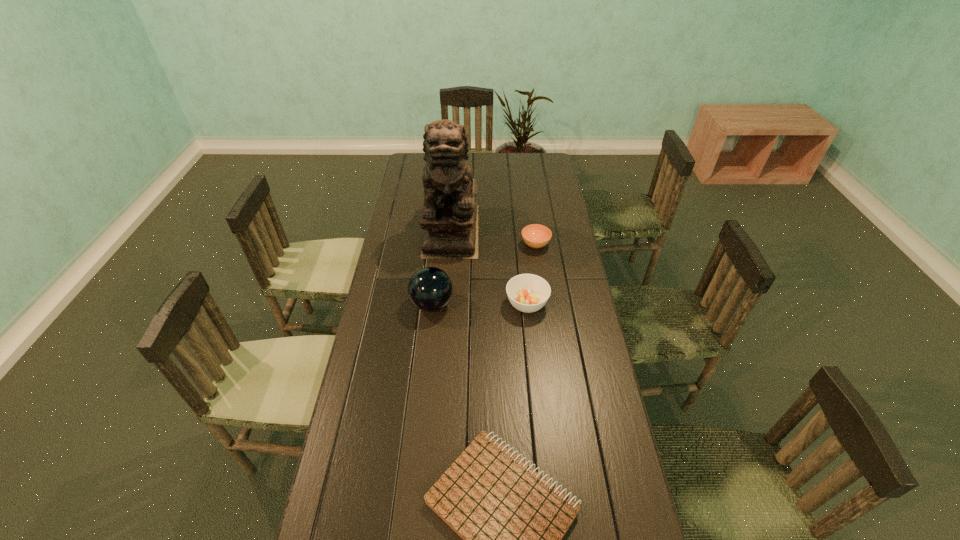
Image resolution: width=960 pixels, height=540 pixels. In order to click on sculpture in this screenshot , I will do pos(449,218).

What are the coordinates of `the fourth shortest object` in the screenshot? It's located at (430, 289).

Locate an element on the screen. This screenshot has width=960, height=540. the third tallest object is located at coordinates (528, 293).

This screenshot has height=540, width=960. Find the location of `the nearer soup bowl`. the nearer soup bowl is located at coordinates (528, 293).

Identify the location of the farther soup bowl. This screenshot has height=540, width=960. (535, 235).

Locate an element on the screen. the second shortest object is located at coordinates (535, 235).

Locate an element on the screen. free space located 0.060m on the front-facing side of the tallest object is located at coordinates [x=448, y=269].

This screenshot has height=540, width=960. Find the location of `vacant region located 0.190m on the side of the bowling ball with the finger holes`. vacant region located 0.190m on the side of the bowling ball with the finger holes is located at coordinates (507, 305).

Find the location of a particular element. This screenshot has height=540, width=960. vacant space located 0.070m on the left of the taller soup bowl is located at coordinates (486, 304).

You are a GUI agent. You are given a task and a screenshot of the screen. Output one action in this format:
    pyautogui.click(x=<x>, y=<y>)
    Task: Click on the free space located 0.270m on the front of the farther soup bowl
    This screenshot has height=540, width=960.
    Given the screenshot: What is the action you would take?
    pyautogui.click(x=543, y=303)